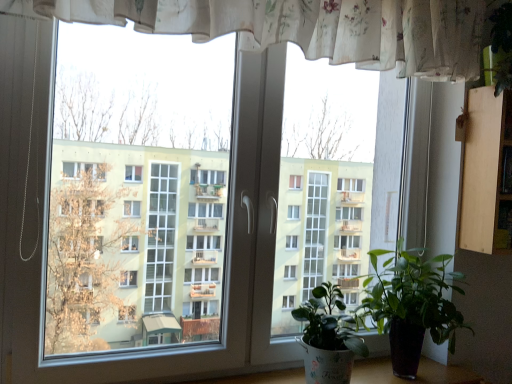
Question: Considering the relative sizes of green glossy plant at lower right, placed as the second houseplant when sorted from left to right, and green glossy leafy plant at lower right, which is the second houseplant in right-to-left order, in the image provided, is green glossy plant at lower right, placed as the second houseplant when sorted from left to right, shorter than green glossy leafy plant at lower right, which is the second houseplant in right-to-left order,?

Choices:
 (A) no
 (B) yes

Answer: (A)

Question: Would you say green glossy plant at lower right, which ranks as the first houseplant in right-to-left order, is outside green glossy leafy plant at lower right, which is the first houseplant from left to right?

Choices:
 (A) no
 (B) yes

Answer: (B)

Question: Does green glossy plant at lower right, placed as the second houseplant when sorted from left to right, appear on the left side of green glossy leafy plant at lower right, which is the first houseplant from left to right?

Choices:
 (A) no
 (B) yes

Answer: (A)

Question: Could you tell me if green glossy plant at lower right, which ranks as the first houseplant in right-to-left order, is turned towards green glossy leafy plant at lower right, which is the second houseplant in right-to-left order?

Choices:
 (A) no
 (B) yes

Answer: (A)

Question: Is green glossy leafy plant at lower right, which is the second houseplant in right-to-left order, at the back of green glossy plant at lower right, which ranks as the first houseplant in right-to-left order?

Choices:
 (A) yes
 (B) no

Answer: (B)

Question: Can you confirm if green glossy plant at lower right, which ranks as the first houseplant in right-to-left order, is smaller than green glossy leafy plant at lower right, which is the first houseplant from left to right?

Choices:
 (A) no
 (B) yes

Answer: (A)

Question: Can you confirm if green glossy leafy plant at lower right, which is the second houseplant in right-to-left order, is shorter than green glossy plant at lower right, which ranks as the first houseplant in right-to-left order?

Choices:
 (A) yes
 (B) no

Answer: (A)

Question: Is green glossy leafy plant at lower right, which is the second houseplant in right-to-left order, positioned behind green glossy plant at lower right, placed as the second houseplant when sorted from left to right?

Choices:
 (A) yes
 (B) no

Answer: (B)

Question: Does green glossy leafy plant at lower right, which is the first houseplant from left to right, have a greater width compared to green glossy plant at lower right, which ranks as the first houseplant in right-to-left order?

Choices:
 (A) no
 (B) yes

Answer: (A)

Question: Is green glossy leafy plant at lower right, which is the first houseplant from left to right, oriented away from green glossy plant at lower right, placed as the second houseplant when sorted from left to right?

Choices:
 (A) no
 (B) yes

Answer: (A)

Question: Is green glossy plant at lower right, which ranks as the first houseplant in right-to-left order, a part of green glossy leafy plant at lower right, which is the first houseplant from left to right?

Choices:
 (A) yes
 (B) no

Answer: (B)

Question: Considering the relative sizes of green glossy leafy plant at lower right, which is the first houseplant from left to right, and green glossy plant at lower right, which ranks as the first houseplant in right-to-left order, in the image provided, is green glossy leafy plant at lower right, which is the first houseplant from left to right, smaller than green glossy plant at lower right, which ranks as the first houseplant in right-to-left order,?

Choices:
 (A) yes
 (B) no

Answer: (A)

Question: Considering the positions of green glossy plant at lower right, placed as the second houseplant when sorted from left to right, and green glossy leafy plant at lower right, which is the first houseplant from left to right, in the image, is green glossy plant at lower right, placed as the second houseplant when sorted from left to right, bigger or smaller than green glossy leafy plant at lower right, which is the first houseplant from left to right,?

Choices:
 (A) big
 (B) small

Answer: (A)